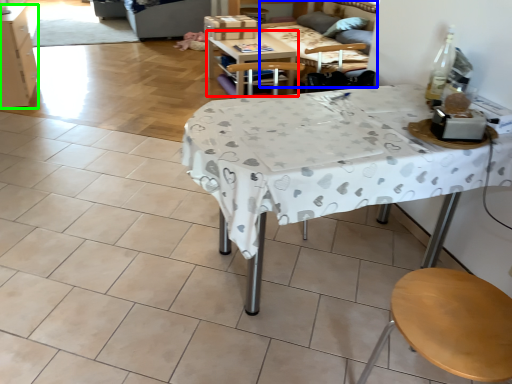
Question: Considering the real-world distances, which object is closest to table (highlighted by a red box)? couch (highlighted by a blue box) or cabinetry (highlighted by a green box).

Choices:
 (A) couch
 (B) cabinetry

Answer: (A)